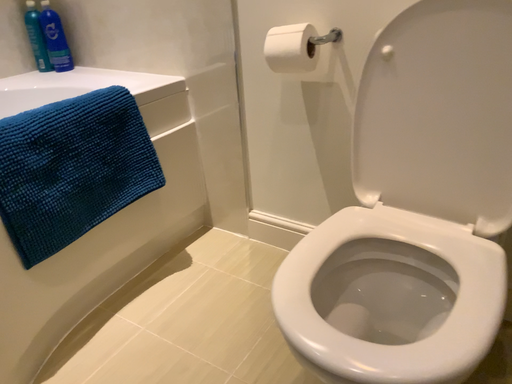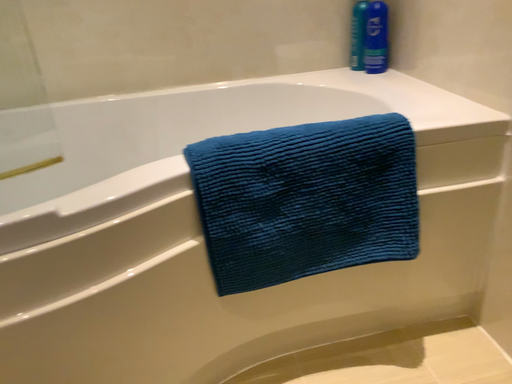
Question: Which way did the camera rotate in the video?

Choices:
 (A) rotated downward
 (B) rotated upward

Answer: (B)